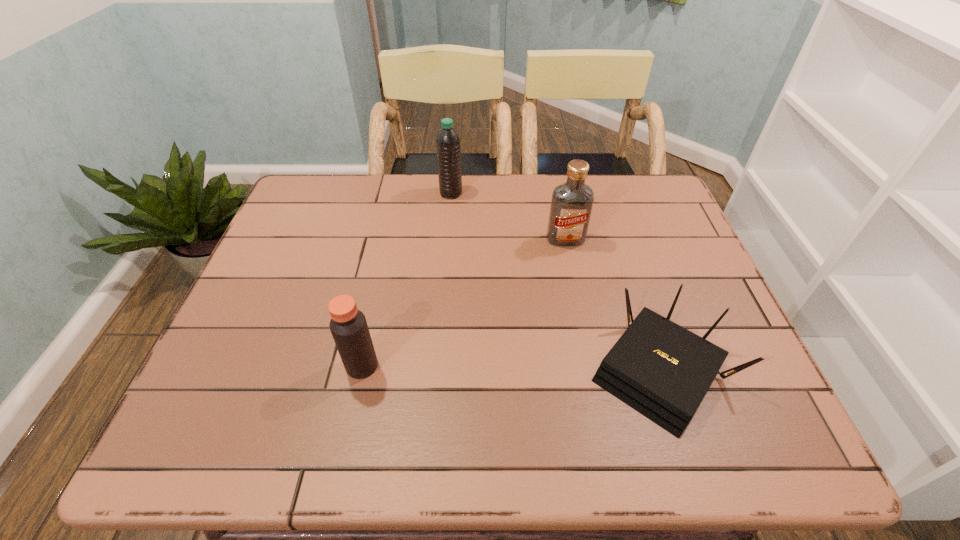
What are the coordinates of `the second object from left to right` in the screenshot? It's located at (448, 146).

What are the coordinates of `the farthest object` in the screenshot? It's located at (448, 146).

Locate an element on the screen. This screenshot has height=540, width=960. the second farthest object is located at coordinates (571, 205).

The width and height of the screenshot is (960, 540). Identify the location of the leftmost object. (348, 325).

Find the location of a particular element. the third tallest object is located at coordinates (348, 325).

Find the location of a particular element. router is located at coordinates point(660,369).

Identify the location of free space located 0.080m on the right of the third object from right to left. (488, 193).

You are a GUI agent. You are given a task and a screenshot of the screen. Output one action in this format:
    pyautogui.click(x=<x>, y=<y>)
    Task: Click on the vacant space located on the front-facing side of the vodka
    This screenshot has width=960, height=540.
    Given the screenshot: What is the action you would take?
    pyautogui.click(x=576, y=291)

Image resolution: width=960 pixels, height=540 pixels. Find the location of `vacant space located on the back of the leftmost object`. vacant space located on the back of the leftmost object is located at coordinates (385, 261).

Locate an element on the screen. free space located 0.180m on the left of the router is located at coordinates (504, 373).